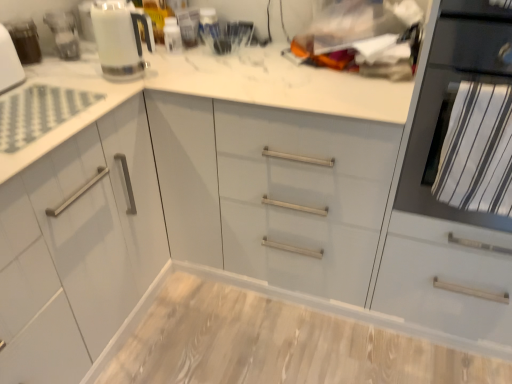
The image size is (512, 384). Describe the element at coordinates (120, 39) in the screenshot. I see `white glossy kettle at upper left` at that location.

Find the location of a particular element. black matte oven at right is located at coordinates (452, 101).

What is the approximate width of wooden at center?

It is 24.81 inches.

You are a GUI agent. You are given a task and a screenshot of the screen. Output one action in this format:
    pyautogui.click(x=<x>, y=<y>)
    Task: Click on the white glossy kettle at upper left
    
    Given the screenshot: What is the action you would take?
    pyautogui.click(x=120, y=39)

Based on the photo, is matte white kettle at upper left bigger than black matte oven at right?

No, matte white kettle at upper left is not bigger than black matte oven at right.

Would you say matte white kettle at upper left is outside black matte oven at right?

Yes.

Is matte white kettle at upper left facing away from black matte oven at right?

No, black matte oven at right is not at the back of matte white kettle at upper left.

Can you confirm if matte white kettle at upper left is thinner than black matte oven at right?

Yes.

Is white glossy kettle at upper left at the left side of black matte oven at right?

Correct, you'll find white glossy kettle at upper left to the left of black matte oven at right.

Is white glossy kettle at upper left wider or thinner than black matte oven at right?

white glossy kettle at upper left is thinner than black matte oven at right.

Which is behind, point (108, 71) or point (420, 207)?

Positioned behind is point (108, 71).

Which of these two, wooden at center or matte white kettle at upper left, is smaller?

Smaller between the two is matte white kettle at upper left.

Does wooden at center turn towards matte white kettle at upper left?

No, wooden at center is not aimed at matte white kettle at upper left.

Considering the points (207, 304) and (54, 32), which point is behind, point (207, 304) or point (54, 32)?

The point (207, 304) is behind.

How different are the orientations of wooden at center and matte white kettle at upper left in degrees?

There is a 88.9-degree angle between the facing directions of wooden at center and matte white kettle at upper left.

From the picture: Is white glossy kettle at upper left to the left of matte white kettle at upper left from the viewer's perspective?

Incorrect, white glossy kettle at upper left is not on the left side of matte white kettle at upper left.

Is white glossy kettle at upper left spatially inside matte white kettle at upper left, or outside of it?

white glossy kettle at upper left cannot be found inside matte white kettle at upper left.

Is white glossy kettle at upper left wider or thinner than matte white kettle at upper left?

Clearly, white glossy kettle at upper left has more width compared to matte white kettle at upper left.

Considering the positions of point (103, 45) and point (367, 362), is point (103, 45) closer or farther from the camera than point (367, 362)?

Clearly, point (103, 45) is closer to the camera than point (367, 362).

Considering the relative sizes of white glossy kettle at upper left and wooden at center in the image provided, is white glossy kettle at upper left bigger than wooden at center?

Actually, white glossy kettle at upper left might be smaller than wooden at center.

Visually, is white glossy kettle at upper left positioned to the left or to the right of wooden at center?

white glossy kettle at upper left is positioned on wooden at center's left side.

Consider the image. Considering the relative sizes of matte white kettle at upper left and wooden at center in the image provided, is matte white kettle at upper left shorter than wooden at center?

No, matte white kettle at upper left is not shorter than wooden at center.

Does matte white kettle at upper left appear on the left side of wooden at center?

Correct, you'll find matte white kettle at upper left to the left of wooden at center.

Considering the positions of point (54, 24) and point (205, 305), is point (54, 24) closer or farther from the camera than point (205, 305)?

Point (54, 24) is closer to the camera than point (205, 305).

Can you confirm if matte white kettle at upper left is thinner than wooden at center?

Yes, matte white kettle at upper left is thinner than wooden at center.

Is black matte oven at right not close to matte white kettle at upper left?

Yes, black matte oven at right and matte white kettle at upper left are quite far apart.

Between black matte oven at right and matte white kettle at upper left, which one has larger width?

black matte oven at right is wider.

Is black matte oven at right in front of or behind matte white kettle at upper left in the image?

black matte oven at right is positioned closer to the viewer than matte white kettle at upper left.

Image resolution: width=512 pixels, height=384 pixels. What are the coordinates of `home appliance beneath the matte white kettle at upper left (from a real-world perspective)` in the screenshot? It's located at (452, 101).

In the image, there is a black matte oven at right. At what (x,y) coordinates should I click in order to perform the action: click on kitchen appliance above it (from the image's perspective). Please return your answer as a coordinate pair (x, y). Looking at the image, I should click on (120, 39).

When comparing their distances from wooden at center, does matte white kettle at upper left or black matte oven at right seem further?

The object further to wooden at center is matte white kettle at upper left.

Based on their spatial positions, is black matte oven at right or white glossy kettle at upper left closer to wooden at center?

black matte oven at right.

Considering their positions, is wooden at center positioned further to matte white kettle at upper left than white glossy kettle at upper left?

Among the two, wooden at center is located further to matte white kettle at upper left.

Based on their spatial positions, is matte white kettle at upper left or wooden at center further from black matte oven at right?

Based on the image, matte white kettle at upper left appears to be further to black matte oven at right.

Considering their positions, is black matte oven at right positioned closer to white glossy kettle at upper left than matte white kettle at upper left?

The object closer to white glossy kettle at upper left is matte white kettle at upper left.

Looking at the image, which one is located further to white glossy kettle at upper left, matte white kettle at upper left or black matte oven at right?

Among the two, black matte oven at right is located further to white glossy kettle at upper left.

Estimate the real-world distances between objects in this image. Which object is further from black matte oven at right, matte white kettle at upper left or white glossy kettle at upper left?

Among the two, matte white kettle at upper left is located further to black matte oven at right.

Based on their spatial positions, is matte white kettle at upper left or white glossy kettle at upper left further from wooden at center?

Based on the image, matte white kettle at upper left appears to be further to wooden at center.

At what (x,y) coordinates should I click in order to perform the action: click on home appliance between white glossy kettle at upper left and wooden at center in the vertical direction. Please return your answer as a coordinate pair (x, y). The width and height of the screenshot is (512, 384). Looking at the image, I should click on (452, 101).

Identify the location of kitchen appliance that lies between matte white kettle at upper left and wooden at center from top to bottom. (120, 39).

You are a GUI agent. You are given a task and a screenshot of the screen. Output one action in this format:
    pyautogui.click(x=<x>, y=<y>)
    Task: Click on the kitchen appliance located between matte white kettle at upper left and black matte oven at right in the left-right direction
    
    Given the screenshot: What is the action you would take?
    pyautogui.click(x=120, y=39)

This screenshot has height=384, width=512. Find the location of `counter located between matte white kettle at upper left and black matte oven at right in the left-right direction`. counter located between matte white kettle at upper left and black matte oven at right in the left-right direction is located at coordinates (276, 339).